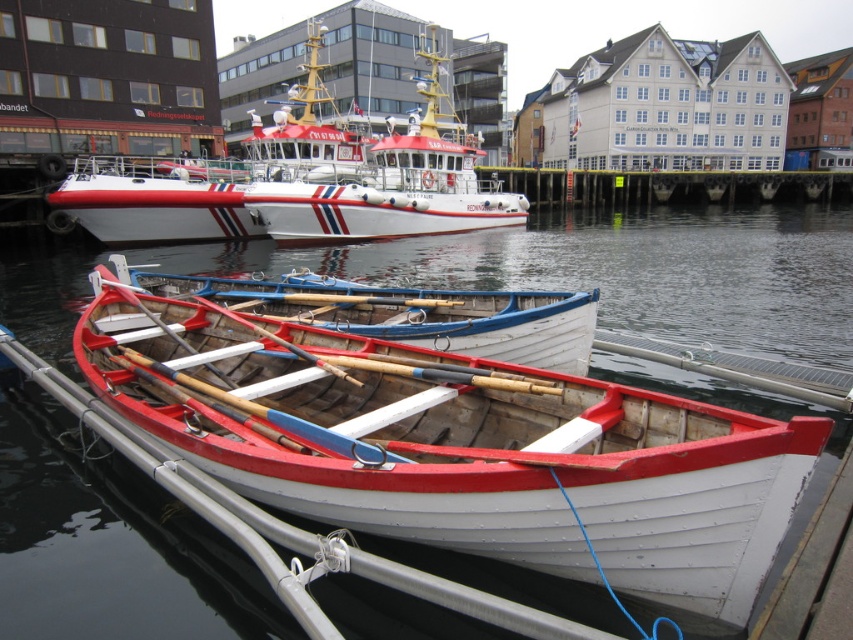
Consider the image. You are standing on the pier and want to board the wooden canoe at center. Which direction should you go relative to the white glossy boat at upper center?

The wooden canoe at center is positioned under the white glossy boat at upper center, so you should go downward from the white glossy boat at upper center to reach the wooden canoe at center.

What are the coordinates of the wooden canoe at center?

The wooden canoe at center is located at coordinates point (450,440).